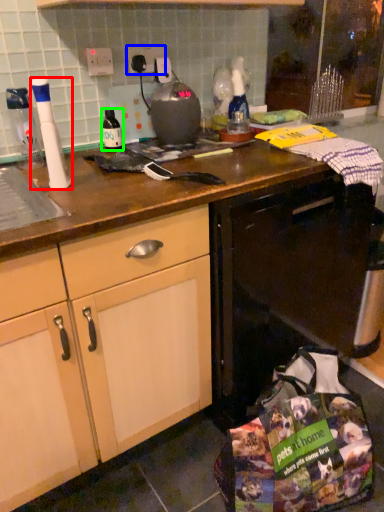
Question: Considering the real-world distances, which object is farthest from kitchen appliance (highlighted by a red box)? electric outlet (highlighted by a blue box) or bottle (highlighted by a green box)?

Choices:
 (A) electric outlet
 (B) bottle

Answer: (A)